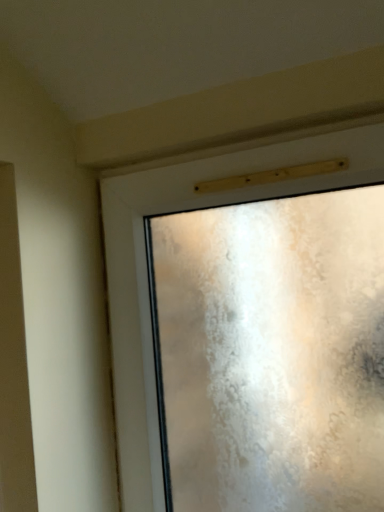
What do you see at coordinates (147, 279) in the screenshot?
I see `frosted glass window at upper center` at bounding box center [147, 279].

In order to click on frosted glass window at upper center in this screenshot , I will do click(147, 279).

At what (x,y) coordinates should I click in order to perform the action: click on frosted glass window at upper center. Please return your answer as a coordinate pair (x, y). This screenshot has width=384, height=512. Looking at the image, I should click on (147, 279).